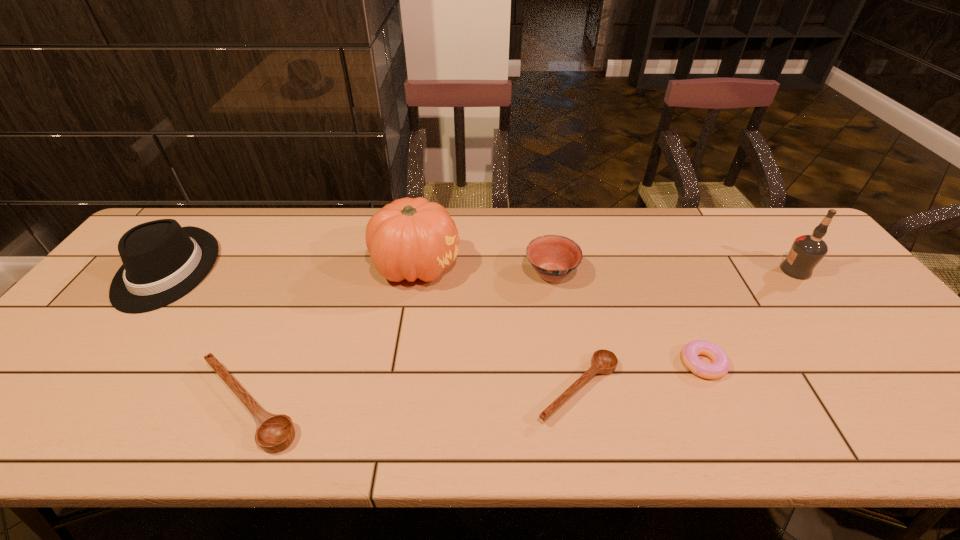
This screenshot has width=960, height=540. What are the coordinates of `vacant region that satisfies the following two spatial constraints: 1. on the carved face of the pumpkin; 2. on the right side of the right wooden spoon` in the screenshot? It's located at (x=396, y=389).

Where is `vacant space that satisfies the following two spatial constraints: 1. on the carved face of the fifth object from right to left; 2. on the left side of the shorter wooden spoon`? The width and height of the screenshot is (960, 540). vacant space that satisfies the following two spatial constraints: 1. on the carved face of the fifth object from right to left; 2. on the left side of the shorter wooden spoon is located at coordinates (396, 389).

The height and width of the screenshot is (540, 960). I want to click on free location that satisfies the following two spatial constraints: 1. on the front label of the vodka; 2. on the front side of the right wooden spoon, so click(x=888, y=389).